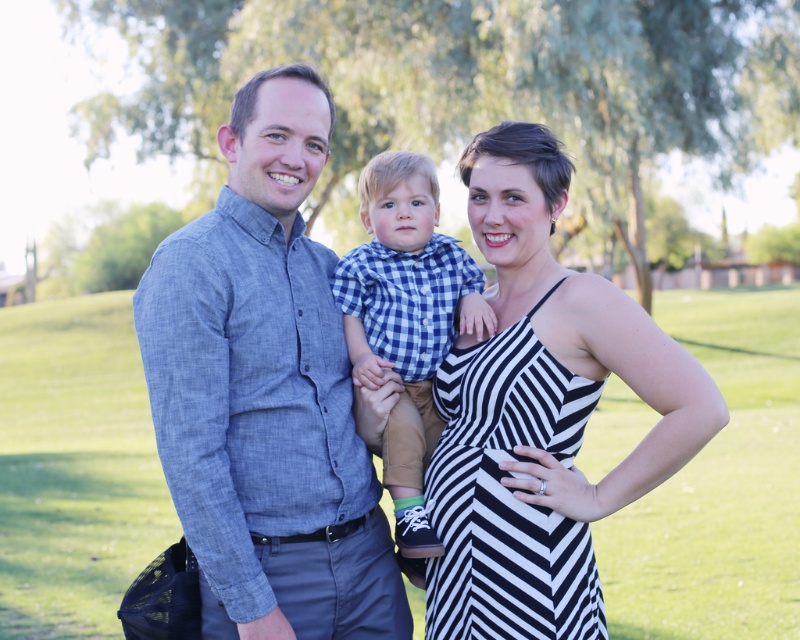
Question: Is blue chambray shirt at center positioned at the back of blue checkered shirt at center?

Choices:
 (A) no
 (B) yes

Answer: (A)

Question: Is blue chambray shirt at center below black and white striped dress at center?

Choices:
 (A) no
 (B) yes

Answer: (A)

Question: Among these objects, which one is nearest to the camera?

Choices:
 (A) blue checkered shirt at center
 (B) blue chambray shirt at center
 (C) black and white striped dress at center
 (D) denim shirt at center

Answer: (D)

Question: Which point appears farthest from the camera in this image?

Choices:
 (A) (364, 572)
 (B) (598, 484)
 (C) (437, 422)
 (D) (270, 580)

Answer: (C)

Question: Can you confirm if denim shirt at center is smaller than black and white striped dress at center?

Choices:
 (A) no
 (B) yes

Answer: (A)

Question: Which object is the farthest from the denim shirt at center?

Choices:
 (A) black and white striped dress at center
 (B) blue checkered shirt at center
 (C) blue chambray shirt at center

Answer: (A)